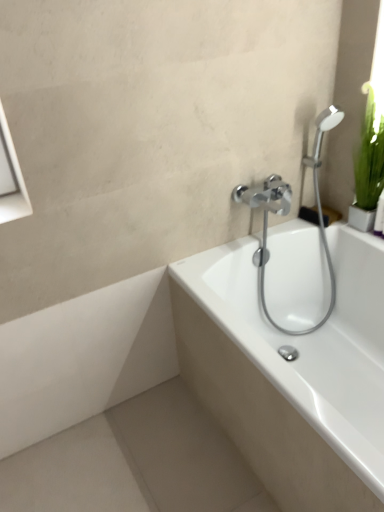
Question: From a real-world perspective, is white glossy bathtub at center physically located above or below chrome metallic showerhead at upper right?

Choices:
 (A) above
 (B) below

Answer: (B)

Question: Considering the positions of white glossy bathtub at center and chrome metallic showerhead at upper right in the image, is white glossy bathtub at center bigger or smaller than chrome metallic showerhead at upper right?

Choices:
 (A) small
 (B) big

Answer: (B)

Question: Relative to chrome metallic showerhead at upper right, is white glossy bathtub at center in front or behind?

Choices:
 (A) front
 (B) behind

Answer: (A)

Question: Choose the correct answer: Is chrome metallic showerhead at upper right inside white glossy bathtub at center or outside it?

Choices:
 (A) outside
 (B) inside

Answer: (B)

Question: Does point (334, 113) appear closer or farther from the camera than point (327, 366)?

Choices:
 (A) farther
 (B) closer

Answer: (B)

Question: Considering the positions of chrome metallic showerhead at upper right and white glossy bathtub at center in the image, is chrome metallic showerhead at upper right wider or thinner than white glossy bathtub at center?

Choices:
 (A) wide
 (B) thin

Answer: (B)

Question: From a real-world perspective, relative to white glossy bathtub at center, is chrome metallic showerhead at upper right vertically above or below?

Choices:
 (A) below
 (B) above

Answer: (B)